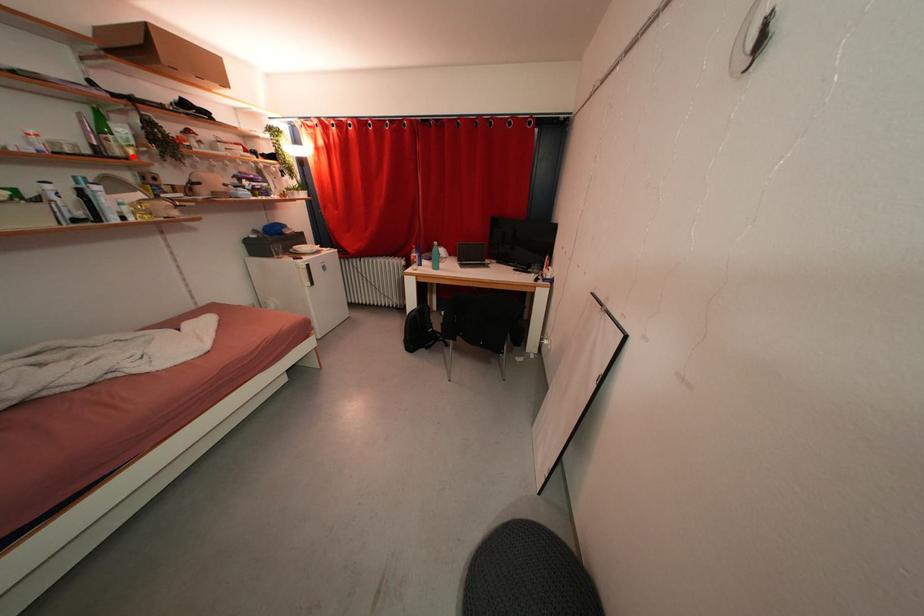
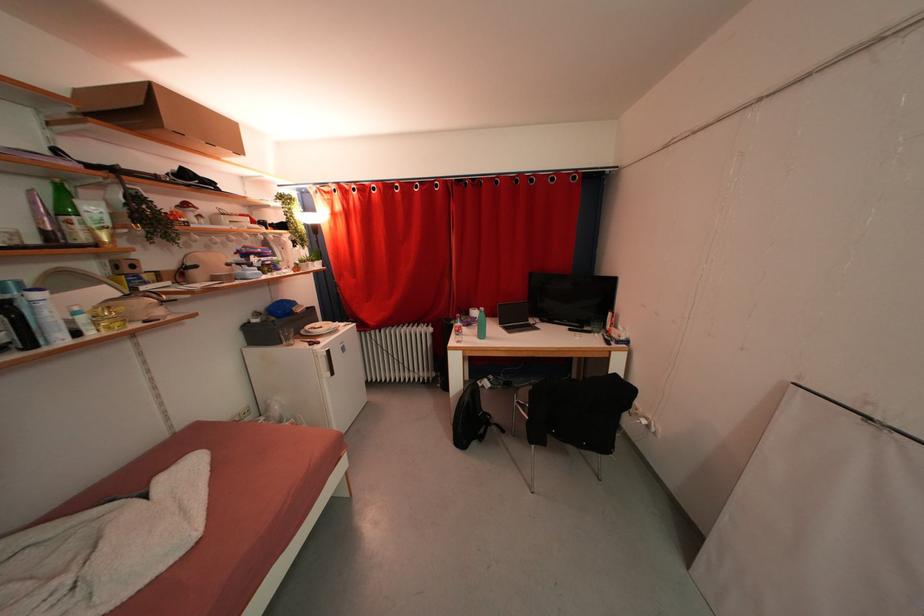
Find the pixel in the second image that matches the highlighted location in the first image.

(102, 241)